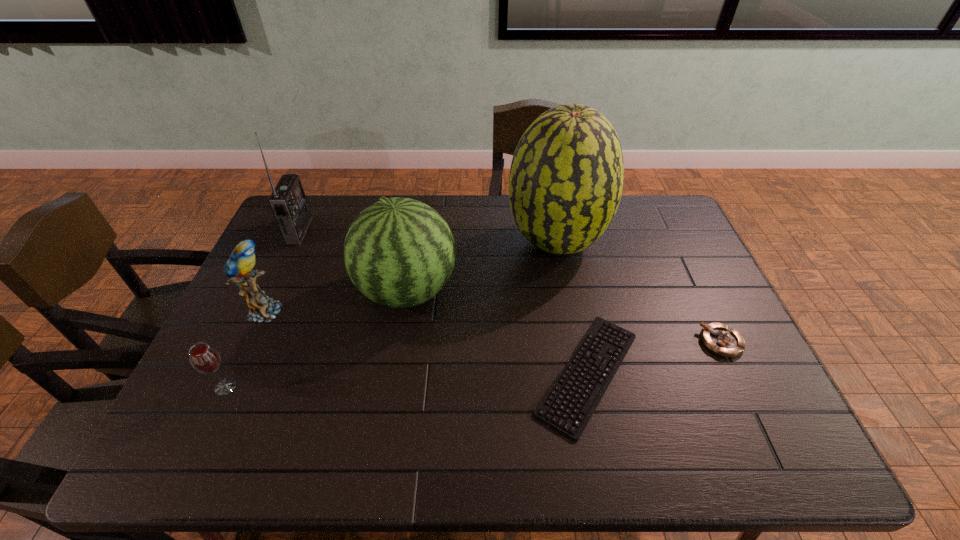
Locate an element on the screen. The image size is (960, 540). vacant space located on the front of the tallest object is located at coordinates (565, 291).

I want to click on free space located 0.090m on the display of the radio receiver, so click(x=333, y=230).

This screenshot has width=960, height=540. What are the coordinates of `free space located on the right of the left watermelon` in the screenshot? It's located at (474, 291).

This screenshot has width=960, height=540. In order to click on vacant position located on the face of the parrot in this screenshot , I will do `click(335, 311)`.

You are a GUI agent. You are given a task and a screenshot of the screen. Output one action in this format:
    pyautogui.click(x=<x>, y=<y>)
    Task: Click on the vacant space situated on the back of the third shortest object
    
    Given the screenshot: What is the action you would take?
    pyautogui.click(x=245, y=345)

At what (x,y) coordinates should I click in order to perform the action: click on free space located 0.200m on the back of the ashtray. Please return your answer as a coordinate pair (x, y). This screenshot has width=960, height=540. Looking at the image, I should click on (689, 275).

Locate an element on the screen. The image size is (960, 540). free space located 0.110m on the back of the computer keyboard is located at coordinates (571, 291).

This screenshot has height=540, width=960. Identify the location of watermelon present at the far edge. [566, 178].

Find the location of a particular element. The image size is (960, 540). radio receiver that is at the far edge is located at coordinates (288, 202).

In order to click on object located at the near edge in this screenshot , I will do `click(569, 403)`.